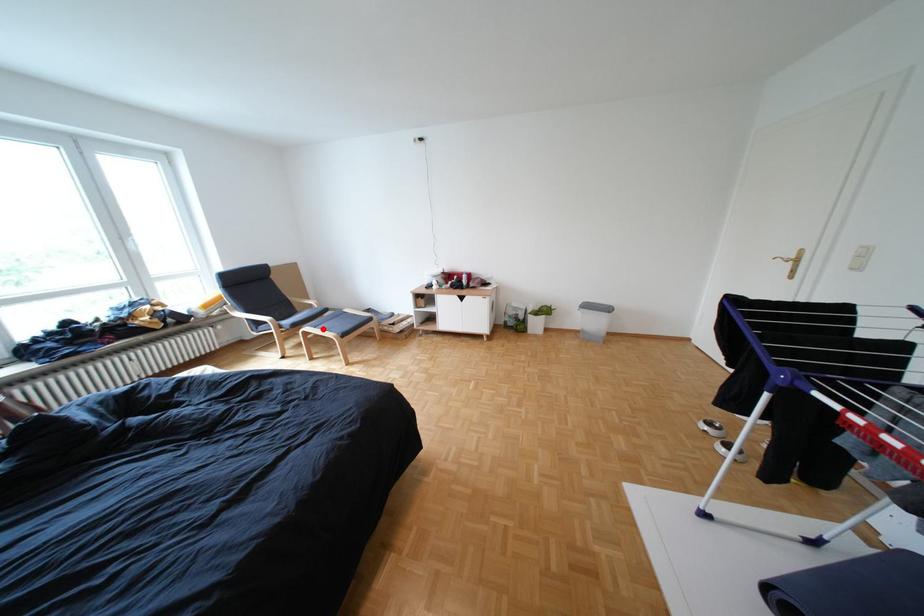
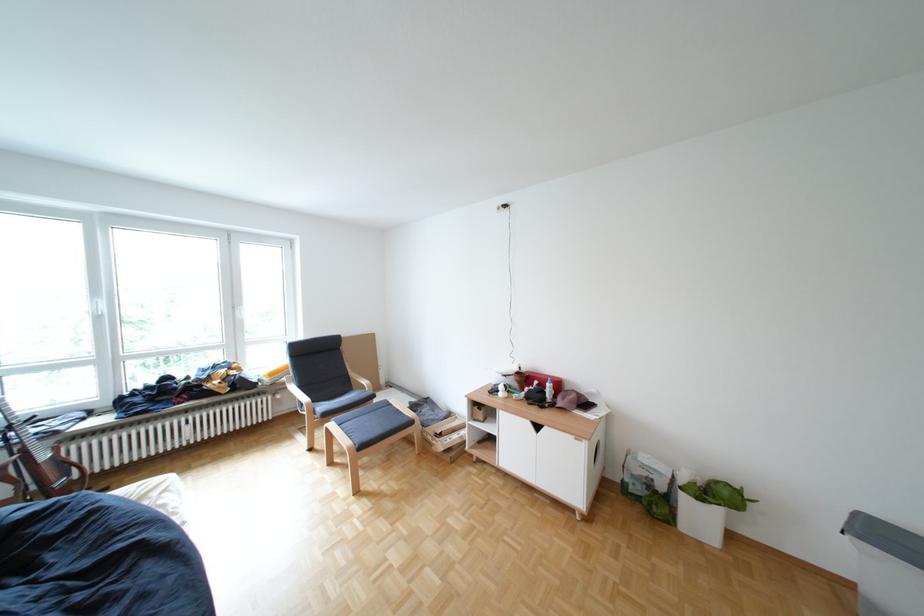
The point at the highlighted location is marked in the first image. Where is the corresponding point in the second image?

(346, 424)